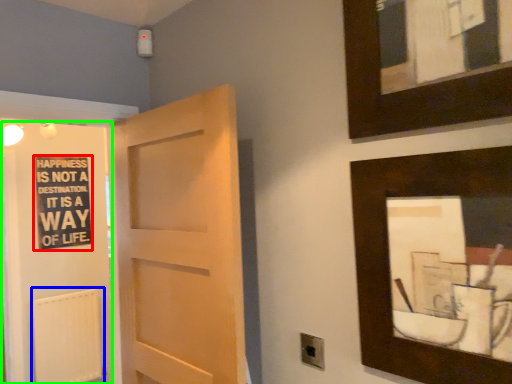
Question: Based on their relative distances, which object is farther from bulletin board (highlighted by a red box)? Choose from radiator (highlighted by a blue box) and elevator (highlighted by a green box).

Choices:
 (A) radiator
 (B) elevator

Answer: (A)